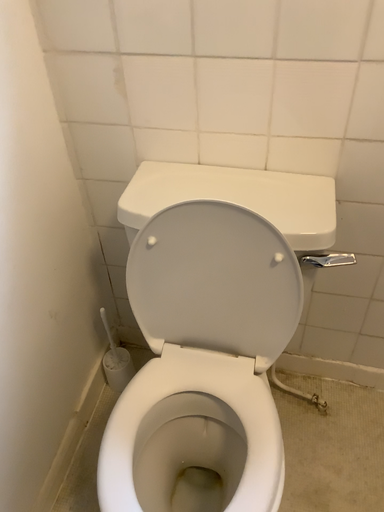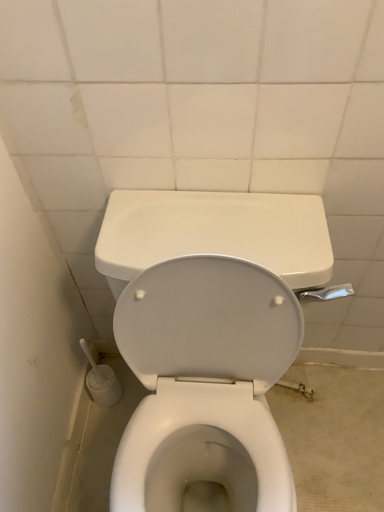
Question: How did the camera likely rotate when shooting the video?

Choices:
 (A) rotated left
 (B) rotated right

Answer: (B)